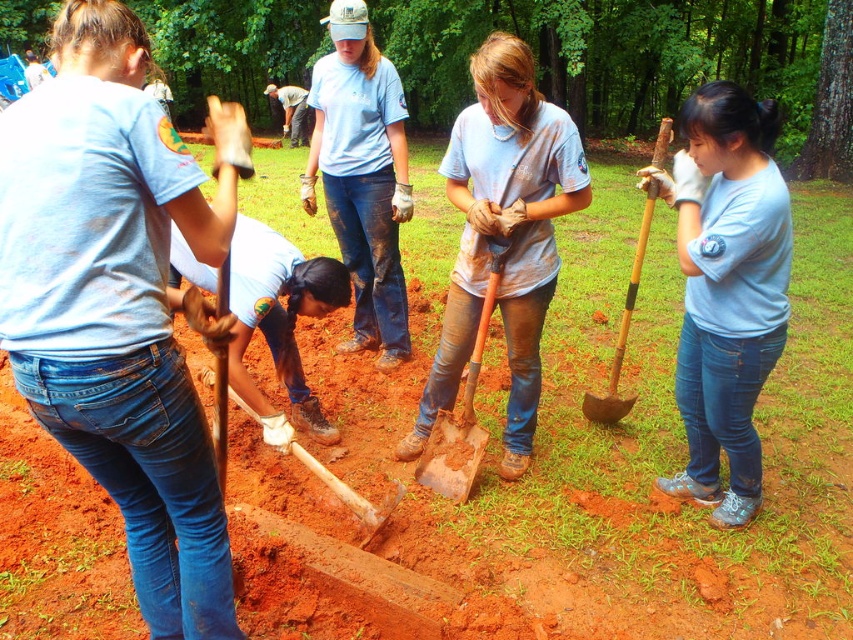
Is white matte shovel at center to the left of brown wooden shovel at right from the viewer's perspective?

Correct, you'll find white matte shovel at center to the left of brown wooden shovel at right.

Does point (201, 278) come behind point (631, 282)?

That is False.

Between point (265, 234) and point (636, 244), which one is positioned in front?

Point (265, 234) is in front.

In order to click on white matte shovel at center in this screenshot , I will do `click(279, 323)`.

Does matte blue shirt at upper left appear over light blue t-shirt at center?

Incorrect, matte blue shirt at upper left is not positioned above light blue t-shirt at center.

Can you confirm if matte blue shirt at upper left is positioned to the right of light blue t-shirt at center?

No, matte blue shirt at upper left is not to the right of light blue t-shirt at center.

Does point (170, 541) lie behind point (376, 324)?

No, (170, 541) is closer to viewer.

Where is `matte blue shirt at upper left`? matte blue shirt at upper left is located at coordinates (119, 300).

Is matte blue shirt at upper left to the left of dirty blue jeans at center from the viewer's perspective?

Correct, you'll find matte blue shirt at upper left to the left of dirty blue jeans at center.

Is matte blue shirt at upper left taller than dirty blue jeans at center?

In fact, matte blue shirt at upper left may be shorter than dirty blue jeans at center.

Where is `matte blue shirt at upper left`? The height and width of the screenshot is (640, 853). matte blue shirt at upper left is located at coordinates (119, 300).